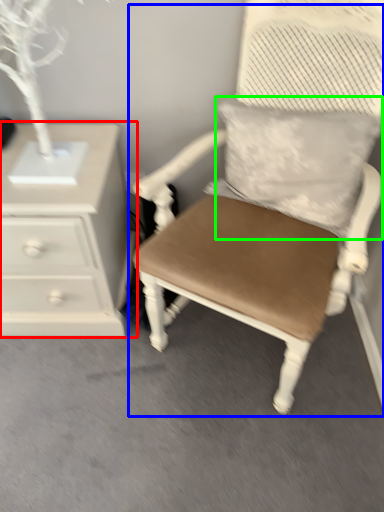
Question: Based on their relative distances, which object is nearer to chest of drawers (highlighted by a red box)? Choose from chair (highlighted by a blue box) and pillow (highlighted by a green box).

Choices:
 (A) chair
 (B) pillow

Answer: (A)